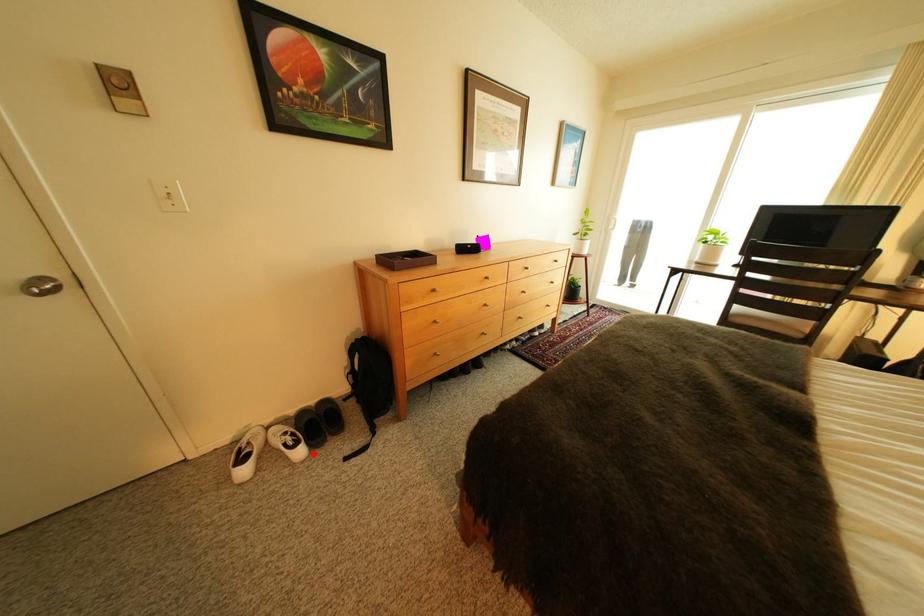
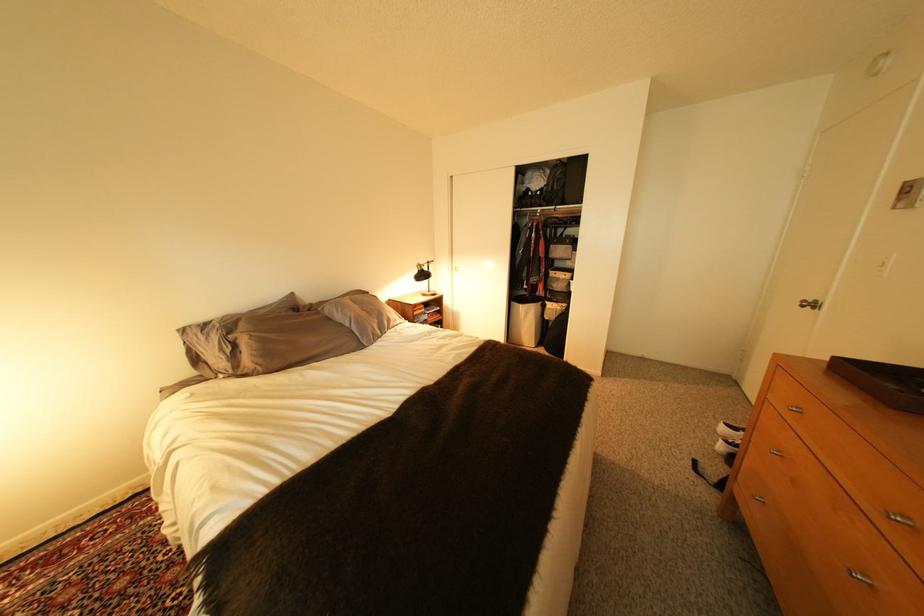
Question: I am providing you with two images of the same scene from different viewpoints. Image1 has a red point marked. In image2, the corresponding 3D location appears at what relative position? Reply with the corresponding letter.

Choices:
 (A) Closer
 (B) Farther

Answer: (B)